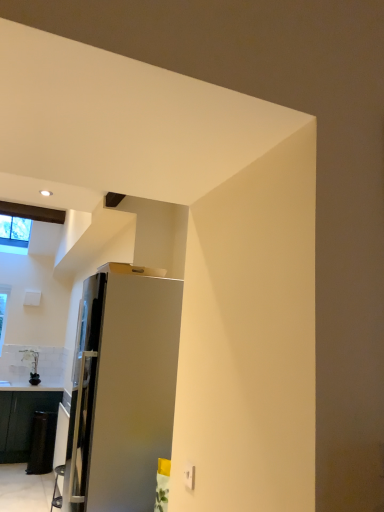
Question: Is black glossy cabinet at lower left surrounded by satin silver refrigerator at center?

Choices:
 (A) yes
 (B) no

Answer: (B)

Question: Does satin silver refrigerator at center turn towards black glossy cabinet at lower left?

Choices:
 (A) yes
 (B) no

Answer: (B)

Question: From a real-world perspective, does satin silver refrigerator at center stand above black glossy cabinet at lower left?

Choices:
 (A) yes
 (B) no

Answer: (A)

Question: Considering the relative sizes of satin silver refrigerator at center and black glossy cabinet at lower left in the image provided, is satin silver refrigerator at center bigger than black glossy cabinet at lower left?

Choices:
 (A) no
 (B) yes

Answer: (B)

Question: From the image's perspective, does satin silver refrigerator at center appear higher than black glossy cabinet at lower left?

Choices:
 (A) yes
 (B) no

Answer: (A)

Question: Looking at their shapes, would you say clear glass window at upper left is wider or thinner than black glossy cabinet at lower left?

Choices:
 (A) wide
 (B) thin

Answer: (A)

Question: From a real-world perspective, is clear glass window at upper left physically located above or below black glossy cabinet at lower left?

Choices:
 (A) above
 (B) below

Answer: (A)

Question: In terms of height, does clear glass window at upper left look taller or shorter compared to black glossy cabinet at lower left?

Choices:
 (A) tall
 (B) short

Answer: (B)

Question: Considering their positions, is clear glass window at upper left located in front of or behind black glossy cabinet at lower left?

Choices:
 (A) front
 (B) behind

Answer: (B)

Question: Looking at their shapes, would you say black glossy cabinet at lower left is wider or thinner than clear glass window at upper left?

Choices:
 (A) thin
 (B) wide

Answer: (A)

Question: From a real-world perspective, is black glossy cabinet at lower left physically located above or below clear glass window at upper left?

Choices:
 (A) above
 (B) below

Answer: (B)

Question: Is point (19, 461) positioned closer to the camera than point (16, 224)?

Choices:
 (A) farther
 (B) closer

Answer: (B)

Question: Is black glossy cabinet at lower left in front of or behind clear glass window at upper left in the image?

Choices:
 (A) behind
 (B) front

Answer: (B)

Question: In terms of height, does satin silver refrigerator at center look taller or shorter compared to clear glass window at upper left?

Choices:
 (A) short
 (B) tall

Answer: (B)

Question: Considering the positions of satin silver refrigerator at center and clear glass window at upper left in the image, is satin silver refrigerator at center bigger or smaller than clear glass window at upper left?

Choices:
 (A) big
 (B) small

Answer: (A)